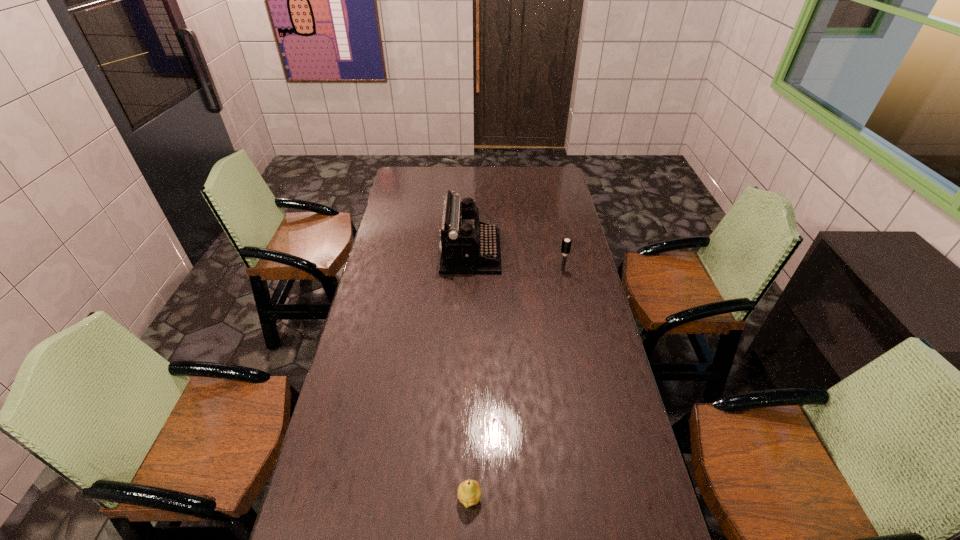
Identify the location of free space at the left edge of the desktop. The image size is (960, 540). (350, 397).

Locate an element on the screen. Image resolution: width=960 pixels, height=540 pixels. vacant space at the right edge of the desktop is located at coordinates (567, 317).

Locate an element on the screen. free space at the far right corner of the desktop is located at coordinates (543, 171).

Image resolution: width=960 pixels, height=540 pixels. Identify the location of unoccupied area between the shortest object and the rightmost object. (516, 384).

What are the coordinates of `empty location between the second shortest object and the nearest object` in the screenshot? It's located at (516, 384).

In order to click on vacant space in between the hairbrush and the shortest object in this screenshot , I will do `click(516, 384)`.

I want to click on empty space between the tallest object and the hairbrush, so click(x=516, y=261).

At what (x,y) coordinates should I click in order to perform the action: click on free spot between the pear and the second shortest object. Please return your answer as a coordinate pair (x, y). The height and width of the screenshot is (540, 960). Looking at the image, I should click on (516, 384).

Find the location of a particular element. The width and height of the screenshot is (960, 540). vacant space that's between the rightmost object and the typewriter is located at coordinates (516, 261).

Identify the location of empty location between the tallest object and the shortest object. (470, 375).